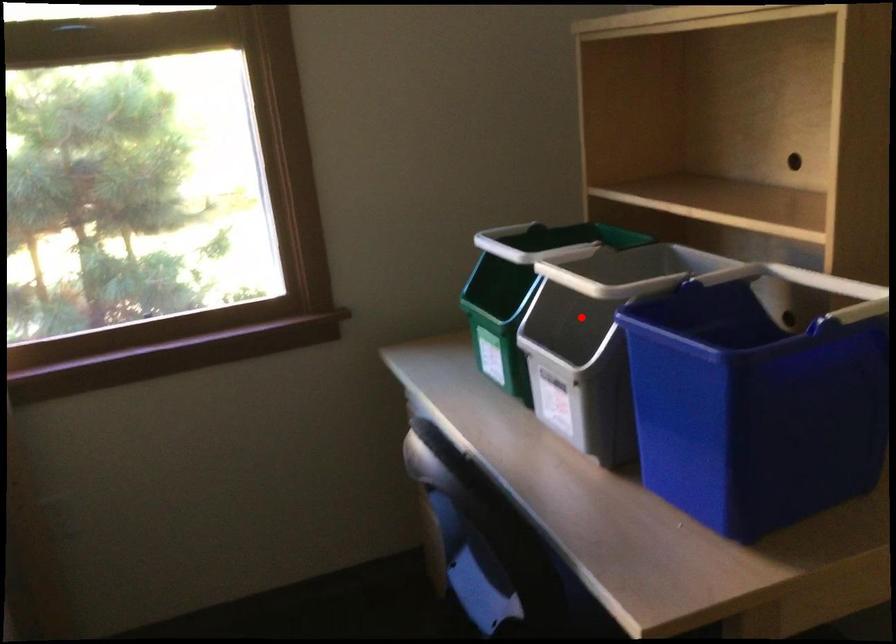
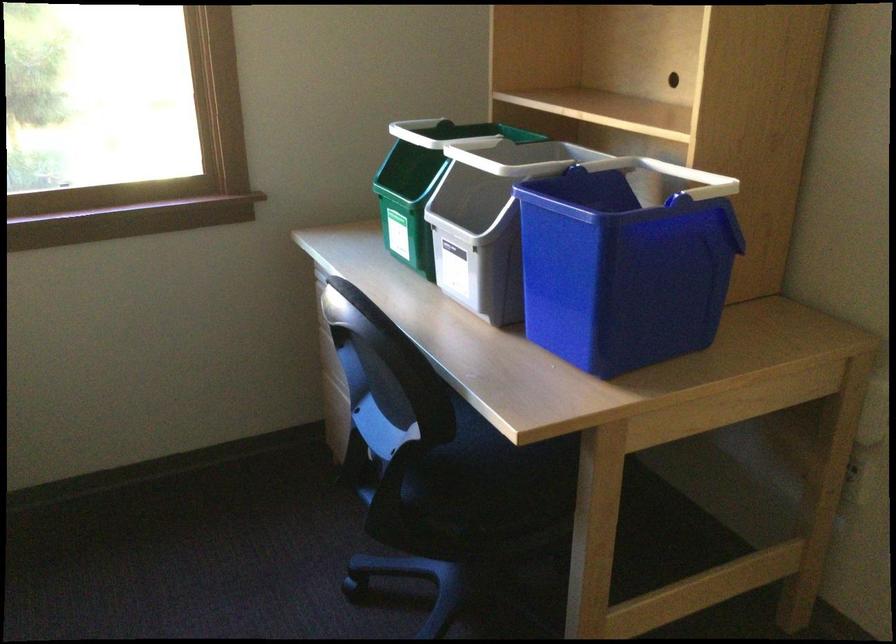
Question: I am providing you with two images of the same scene from different viewpoints. Image1 has a red point marked. In image2, the corresponding 3D location appears at what relative position? Reply with the corresponding letter.

Choices:
 (A) Closer
 (B) Farther

Answer: (B)